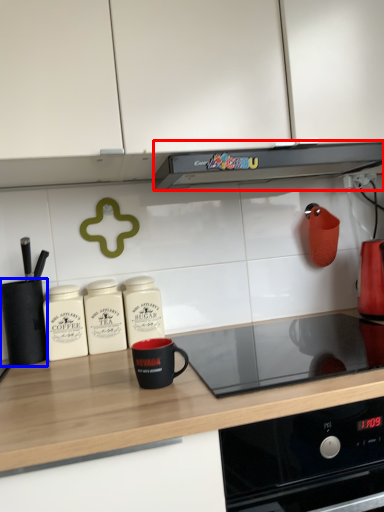
Question: Which object is closer to the camera taking this photo, kitchen appliance (highlighted by a red box) or kitchen appliance (highlighted by a blue box)?

Choices:
 (A) kitchen appliance
 (B) kitchen appliance

Answer: (A)